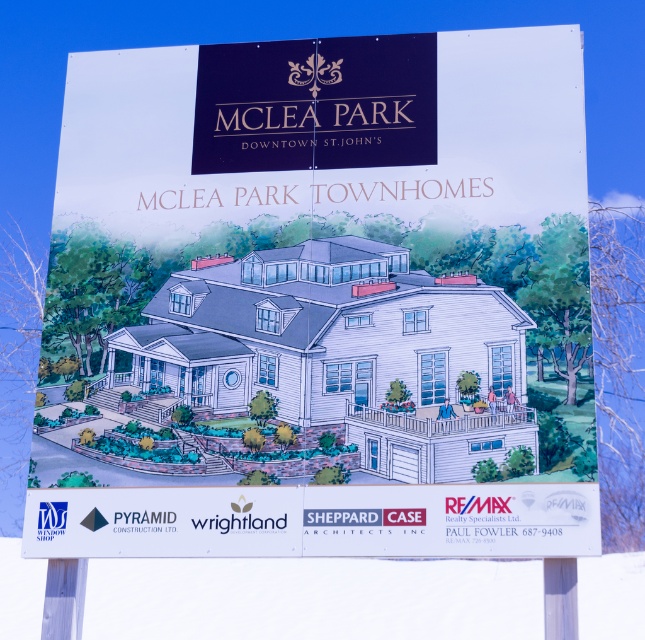
Which is below, wooden post at lower left or white plastic pole at lower right?

wooden post at lower left

Is point (52, 566) farther from viewer compared to point (575, 595)?

That is True.

Does point (75, 621) lie in front of point (570, 557)?

No, (75, 621) is behind (570, 557).

The image size is (645, 640). In order to click on wooden post at lower left in this screenshot , I will do `click(63, 598)`.